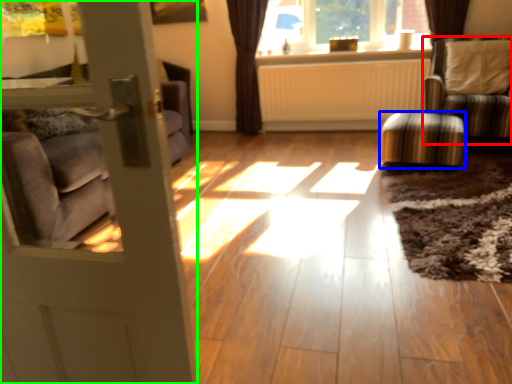
Question: Based on their relative distances, which object is farther from chair (highlighted by a red box)? Choose from stool (highlighted by a blue box) and door (highlighted by a green box).

Choices:
 (A) stool
 (B) door

Answer: (B)